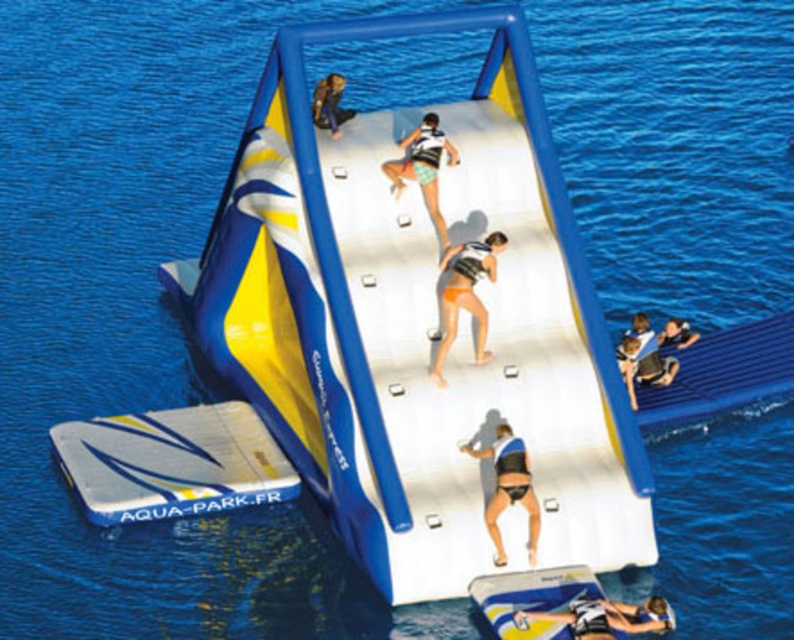
Question: Can you confirm if white matte surfboard at lower right is positioned below leather jacket at upper center?

Choices:
 (A) yes
 (B) no

Answer: (A)

Question: Can you confirm if white matte shorts at center is thinner than matte black life vest at lower right?

Choices:
 (A) no
 (B) yes

Answer: (A)

Question: Does smooth tan skin at lower right have a lesser width compared to matte black life vest at lower right?

Choices:
 (A) no
 (B) yes

Answer: (A)

Question: Which of the following is the closest to the observer?

Choices:
 (A) coord(658,340)
 (B) coord(525,465)
 (C) coord(328,115)

Answer: (B)

Question: Among these objects, which one is nearest to the camera?

Choices:
 (A) black matte bikini at center
 (B) leather jacket at upper center

Answer: (A)

Question: Based on their relative distances, which object is nearer to the tan bikini at center?

Choices:
 (A) matte black life vest at lower right
 (B) smooth tan skin at lower right
 (C) leather jacket at upper center
 (D) black matte bikini at center

Answer: (D)